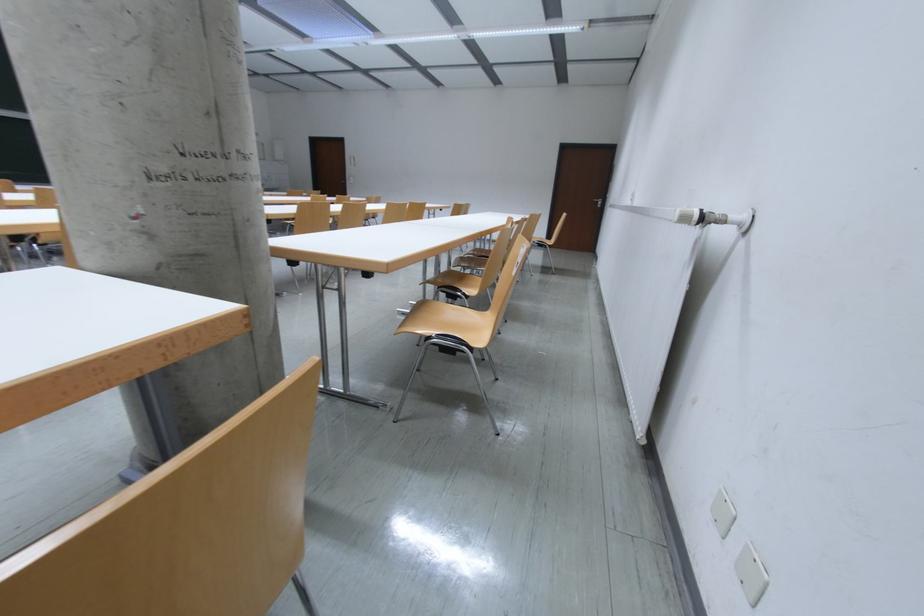
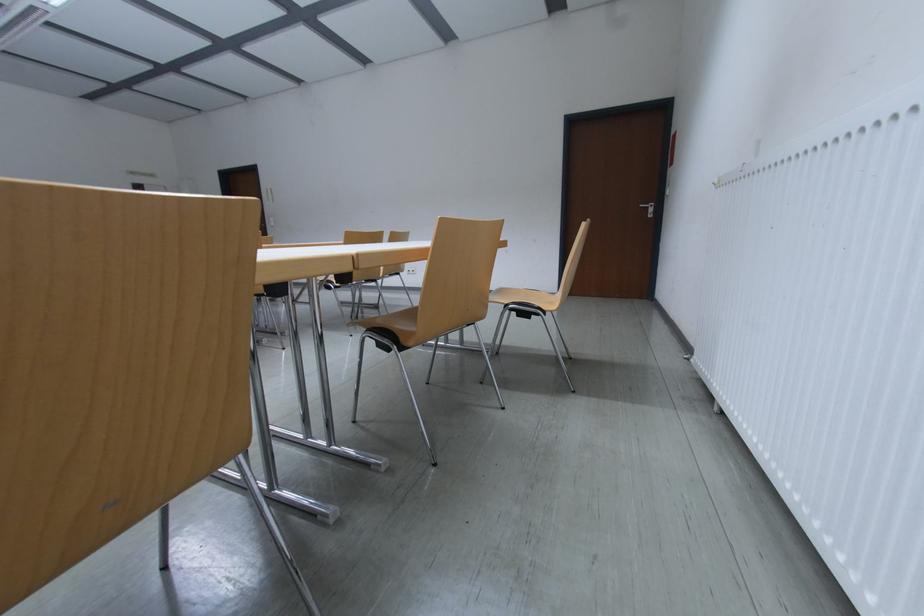
Question: In a continuous first-person perspective shot, in which direction is the camera moving?

Choices:
 (A) Left
 (B) Right
 (C) Forward
 (D) Backward

Answer: (C)